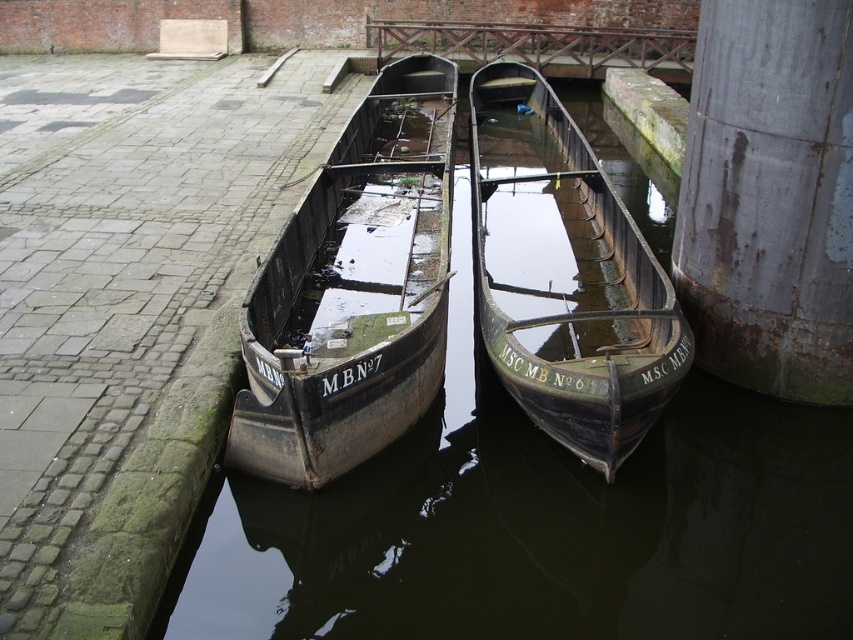
From the picture: Can you confirm if dark brown water at center is positioned below rusty metal boat at center?

Indeed, dark brown water at center is positioned under rusty metal boat at center.

Who is shorter, dark brown water at center or rusty metal boat at center?

dark brown water at center

Who is more distant from viewer, [262,509] or [311,348]?

Point [311,348]

Image resolution: width=853 pixels, height=640 pixels. Find the location of `dark brown water at center`. dark brown water at center is located at coordinates (537, 524).

Can you confirm if rusty metal pillar at right is wider than green wooden boat at center?

Incorrect, rusty metal pillar at right's width does not surpass green wooden boat at center's.

Based on the photo, does rusty metal pillar at right have a smaller size compared to green wooden boat at center?

Yes, rusty metal pillar at right is smaller than green wooden boat at center.

Is point (706, 285) farther from camera compared to point (491, 172)?

That is False.

Image resolution: width=853 pixels, height=640 pixels. I want to click on rusty metal pillar at right, so click(x=769, y=196).

Is rusty metal boat at center positioned at the back of green wooden boat at center?

No, it is not.

What do you see at coordinates (354, 291) in the screenshot?
I see `rusty metal boat at center` at bounding box center [354, 291].

Where is `rusty metal boat at center`? rusty metal boat at center is located at coordinates (354, 291).